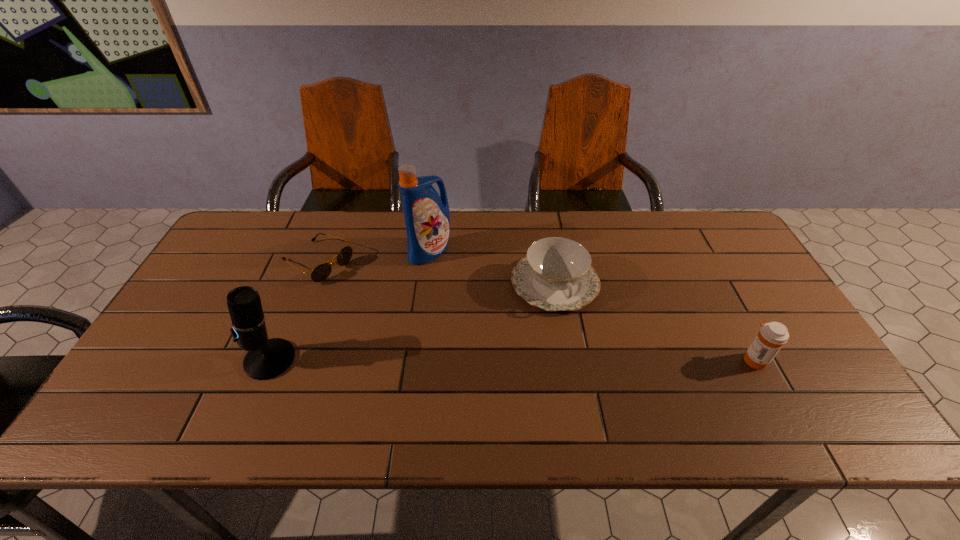
At what (x,y) coordinates should I click in order to perform the action: click on free space located on the label of the tallest object. Please return your answer as a coordinate pair (x, y). The image size is (960, 540). Looking at the image, I should click on (465, 294).

At what (x,y) coordinates should I click in order to perform the action: click on blank area located 0.330m on the label of the tallest object. Please return your answer as a coordinate pair (x, y). Image resolution: width=960 pixels, height=540 pixels. Looking at the image, I should click on (499, 336).

Where is `blank area located 0.100m on the label of the tallest object`? This screenshot has width=960, height=540. blank area located 0.100m on the label of the tallest object is located at coordinates (456, 284).

Find the location of a particular element. The image size is (960, 540). vacant position located 0.400m on the front-facing side of the shortest object is located at coordinates (448, 338).

You are a GUI agent. You are given a task and a screenshot of the screen. Output one action in this format:
    pyautogui.click(x=<x>, y=<y>)
    Task: Click on the blank space located 0.230m on the front-facing side of the shortest object
    This screenshot has width=960, height=540.
    Given the screenshot: What is the action you would take?
    pyautogui.click(x=399, y=309)

The image size is (960, 540). Identify the location of free space located on the front-facing side of the shortest object. (436, 330).

Where is `free space located 0.110m on the handle side of the chinaware`? Image resolution: width=960 pixels, height=540 pixels. free space located 0.110m on the handle side of the chinaware is located at coordinates (580, 348).

Identify the location of free space located 0.230m on the handle side of the chinaware. The image size is (960, 540). (596, 389).

Locate an element on the screen. The height and width of the screenshot is (540, 960). vacant region located 0.070m on the handle side of the chinaware is located at coordinates (575, 336).

The image size is (960, 540). Identify the location of detergent that is at the far edge. (427, 216).